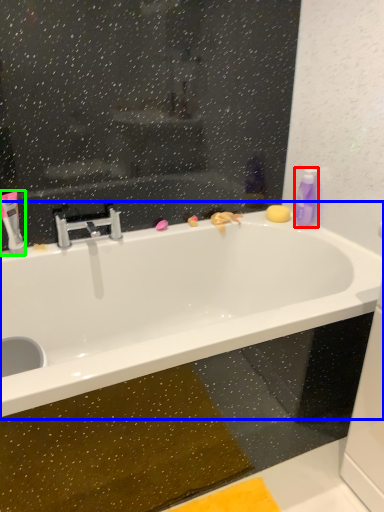
Question: Which object is the closest to the cleaning product (highlighted by a red box)? Choose among these: bathtub (highlighted by a blue box) or mouthwash (highlighted by a green box).

Choices:
 (A) bathtub
 (B) mouthwash

Answer: (A)